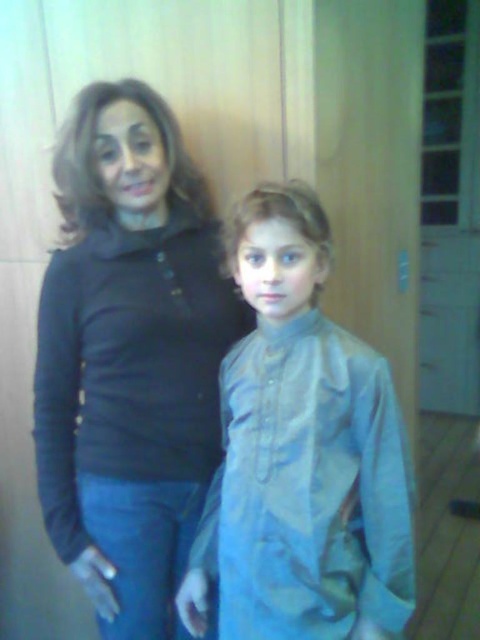
Question: Among these objects, which one is nearest to the camera?

Choices:
 (A) matte black turtleneck at upper left
 (B) light blue fabric shirt at center

Answer: (B)

Question: Can you confirm if matte black turtleneck at upper left is bigger than light blue fabric shirt at center?

Choices:
 (A) yes
 (B) no

Answer: (A)

Question: In this image, where is matte black turtleneck at upper left located relative to light blue fabric shirt at center?

Choices:
 (A) right
 (B) left

Answer: (B)

Question: Can you confirm if matte black turtleneck at upper left is positioned to the right of light blue fabric shirt at center?

Choices:
 (A) yes
 (B) no

Answer: (B)